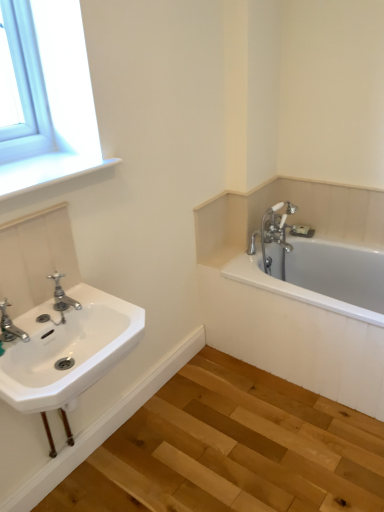
I want to click on vacant space situated above white smooth window sill at upper left (from a real-world perspective), so click(x=24, y=167).